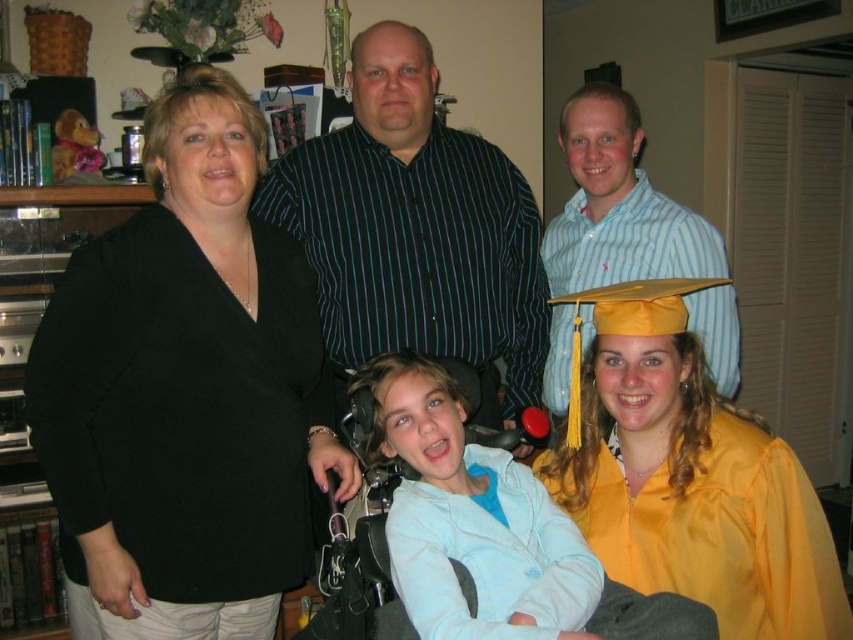
Is black matte blazer at center positioned before yellow satin graduation gown at lower right?

No, it is not.

Which is in front, point (189, 106) or point (666, 538)?

Point (666, 538)

Locate an element on the screen. black matte blazer at center is located at coordinates tap(184, 392).

Between black matte blazer at center and light blue fleece at center, which one has more height?

Standing taller between the two is black matte blazer at center.

Is black matte blazer at center shorter than light blue fleece at center?

No.

Between point (293, 314) and point (421, 497), which one is positioned in front?

Point (421, 497) is more forward.

This screenshot has width=853, height=640. Find the location of `black matte blazer at center`. black matte blazer at center is located at coordinates (184, 392).

Could you measure the distance between yellow satin graduation gown at lower right and light blue striped shirt at upper right?

yellow satin graduation gown at lower right and light blue striped shirt at upper right are 19.74 inches apart from each other.

Is yellow satin graduation gown at lower right taller than light blue striped shirt at upper right?

Incorrect, yellow satin graduation gown at lower right's height is not larger of light blue striped shirt at upper right's.

You are a GUI agent. You are given a task and a screenshot of the screen. Output one action in this format:
    pyautogui.click(x=<x>, y=<y>)
    Task: Click on the yellow satin graduation gown at lower right
    The height and width of the screenshot is (640, 853).
    Given the screenshot: What is the action you would take?
    pyautogui.click(x=688, y=476)